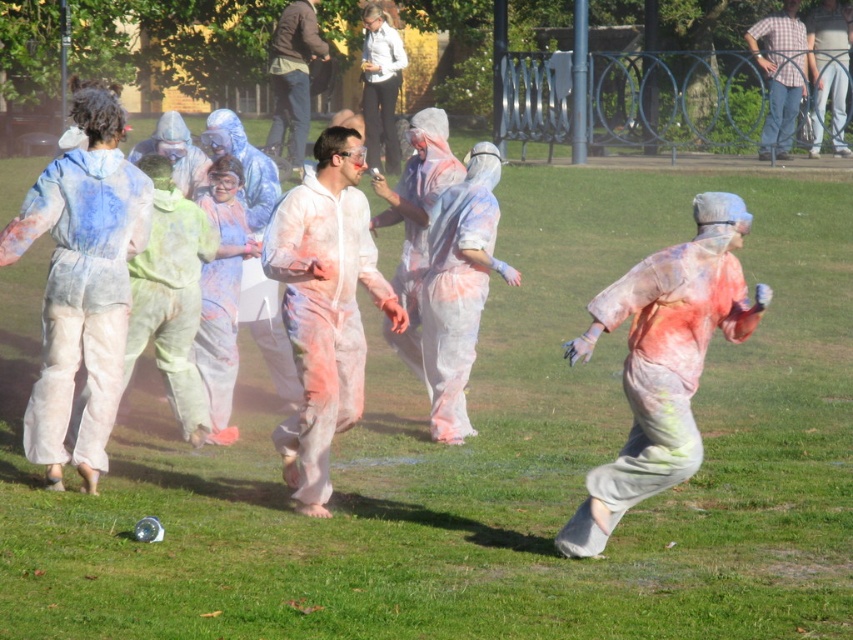
You are a photographer positioned at the front of the color run event. You want to capture both the speckled fabric man at center and the plaid shirt at upper right in a single photo. Which of the two should you focus on first to ensure both are in focus?

The speckled fabric man at center is closer to the viewer than the plaid shirt at upper right, so you should focus on the speckled fabric man at center first to ensure both are in focus.

You are a photographer positioned at the center of the scene. You want to capture a photo that includes both the speckled fabric man at center and the plaid shirt at upper right. What is the minimum distance you need to move backward to ensure both subjects are in frame?

The minimum distance you need to move backward is 53.56 feet divided by the camera lens field of view. However, without knowing the specific field of view, it is impossible to calculate an exact distance. Alternatively, you can estimate by moving back until both the speckled fabric man at center and the plaid shirt at upper right are visible in your camera frame.